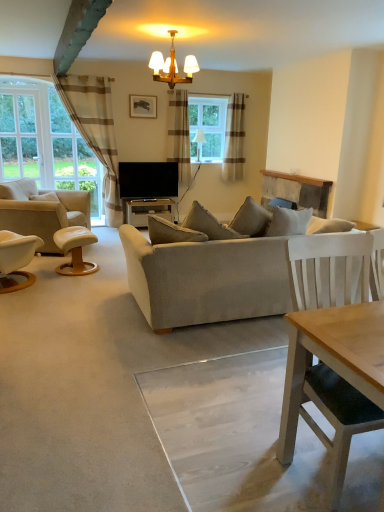
What are the coordinates of `unoccupied area in front of white leather stool at left` in the screenshot? It's located at (67, 284).